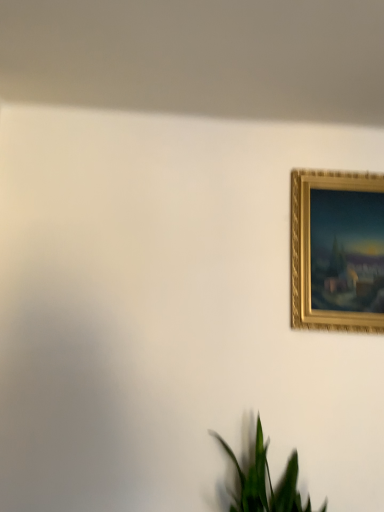
Measure the distance between green leafy plant at lower center and camera.

4.65 feet.

What is the approximate height of green leafy plant at lower center?

green leafy plant at lower center is 13.58 inches tall.

I want to click on green leafy plant at lower center, so click(x=263, y=480).

This screenshot has width=384, height=512. What do you see at coordinates (263, 480) in the screenshot?
I see `green leafy plant at lower center` at bounding box center [263, 480].

Describe the element at coordinates (337, 251) in the screenshot. Image resolution: width=384 pixels, height=512 pixels. I see `gold textured picture frame at upper right` at that location.

This screenshot has width=384, height=512. Identify the location of gold textured picture frame at upper right. (337, 251).

Where is `green leafy plant at lower center`? The image size is (384, 512). green leafy plant at lower center is located at coordinates (263, 480).

Considering the positions of objects gold textured picture frame at upper right and green leafy plant at lower center in the image provided, who is more to the left, gold textured picture frame at upper right or green leafy plant at lower center?

Positioned to the left is green leafy plant at lower center.

Does gold textured picture frame at upper right lie behind green leafy plant at lower center?

Yes, gold textured picture frame at upper right is further from the camera.

Between point (375, 264) and point (252, 482), which one is positioned in front?

Point (252, 482)

From the picture: From the image's perspective, relative to green leafy plant at lower center, is gold textured picture frame at upper right above or below?

Based on their image positions, gold textured picture frame at upper right is located above green leafy plant at lower center.

From a real-world perspective, which object stands above the other?

From a 3D spatial view, gold textured picture frame at upper right is above.

Considering the sizes of gold textured picture frame at upper right and green leafy plant at lower center in the image, is gold textured picture frame at upper right wider or thinner than green leafy plant at lower center?

gold textured picture frame at upper right is thinner than green leafy plant at lower center.

From the picture: Considering the sizes of gold textured picture frame at upper right and green leafy plant at lower center in the image, is gold textured picture frame at upper right taller or shorter than green leafy plant at lower center?

Considering their sizes, gold textured picture frame at upper right has more height than green leafy plant at lower center.

Considering the sizes of objects gold textured picture frame at upper right and green leafy plant at lower center in the image provided, who is bigger, gold textured picture frame at upper right or green leafy plant at lower center?

green leafy plant at lower center is bigger.

Do you think gold textured picture frame at upper right is within green leafy plant at lower center, or outside of it?

The correct answer is: outside.

Are gold textured picture frame at upper right and green leafy plant at lower center located far from each other?

No, gold textured picture frame at upper right is in close proximity to green leafy plant at lower center.

From the picture: Is gold textured picture frame at upper right aimed at green leafy plant at lower center?

No.

How different are the orientations of gold textured picture frame at upper right and green leafy plant at lower center in degrees?

gold textured picture frame at upper right and green leafy plant at lower center are facing 2.25 degrees away from each other.

Measure the distance between gold textured picture frame at upper right and green leafy plant at lower center.

A distance of 26.12 inches exists between gold textured picture frame at upper right and green leafy plant at lower center.

At what (x,y) coordinates should I click in order to perform the action: click on houseplant lying in front of the gold textured picture frame at upper right. Please return your answer as a coordinate pair (x, y). Image resolution: width=384 pixels, height=512 pixels. Looking at the image, I should click on (263, 480).

Considering the relative positions of green leafy plant at lower center and gold textured picture frame at upper right in the image provided, is green leafy plant at lower center to the left or to the right of gold textured picture frame at upper right?

Based on their positions, green leafy plant at lower center is located to the left of gold textured picture frame at upper right.

Which object is closer to the camera taking this photo, green leafy plant at lower center or gold textured picture frame at upper right?

green leafy plant at lower center is in front.

Does point (241, 486) lie in front of point (378, 199)?

Yes, point (241, 486) is closer to viewer.

In the scene shown: From the image's perspective, which one is positioned lower, green leafy plant at lower center or gold textured picture frame at upper right?

From the image's view, green leafy plant at lower center is below.

From a real-world perspective, between green leafy plant at lower center and gold textured picture frame at upper right, who is vertically higher?

gold textured picture frame at upper right is physically above.

Is green leafy plant at lower center wider or thinner than gold textured picture frame at upper right?

Clearly, green leafy plant at lower center has more width compared to gold textured picture frame at upper right.

Which of these two, green leafy plant at lower center or gold textured picture frame at upper right, stands taller?

gold textured picture frame at upper right is taller.

Between green leafy plant at lower center and gold textured picture frame at upper right, which one has larger size?

green leafy plant at lower center is bigger.

Would you say green leafy plant at lower center contains gold textured picture frame at upper right?

No, green leafy plant at lower center does not contain gold textured picture frame at upper right.

Based on the photo, is green leafy plant at lower center far away from gold textured picture frame at upper right?

That's not correct — green leafy plant at lower center is a little close to gold textured picture frame at upper right.

Is green leafy plant at lower center aimed at gold textured picture frame at upper right?

No.

What's the angular difference between green leafy plant at lower center and gold textured picture frame at upper right's facing directions?

The facing directions of green leafy plant at lower center and gold textured picture frame at upper right are 2.25 degrees apart.

Where is `houseplant below the gold textured picture frame at upper right (from a real-world perspective)`? The height and width of the screenshot is (512, 384). houseplant below the gold textured picture frame at upper right (from a real-world perspective) is located at coordinates coord(263,480).

Identify the location of picture frame on the right side of green leafy plant at lower center. (337, 251).

Where is `houseplant on the left of gold textured picture frame at upper right`? houseplant on the left of gold textured picture frame at upper right is located at coordinates (263, 480).